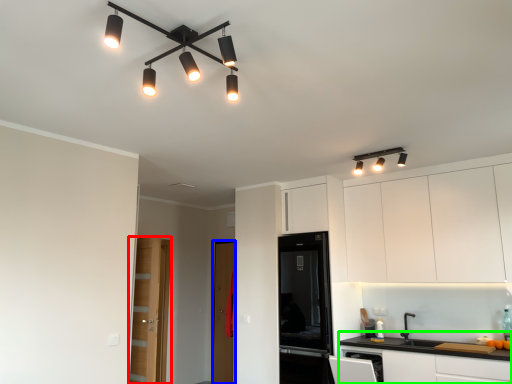
Question: Which is nearer to the door (highlighted by a red box)? glass door (highlighted by a blue box) or cabinetry (highlighted by a green box).

Choices:
 (A) glass door
 (B) cabinetry

Answer: (A)